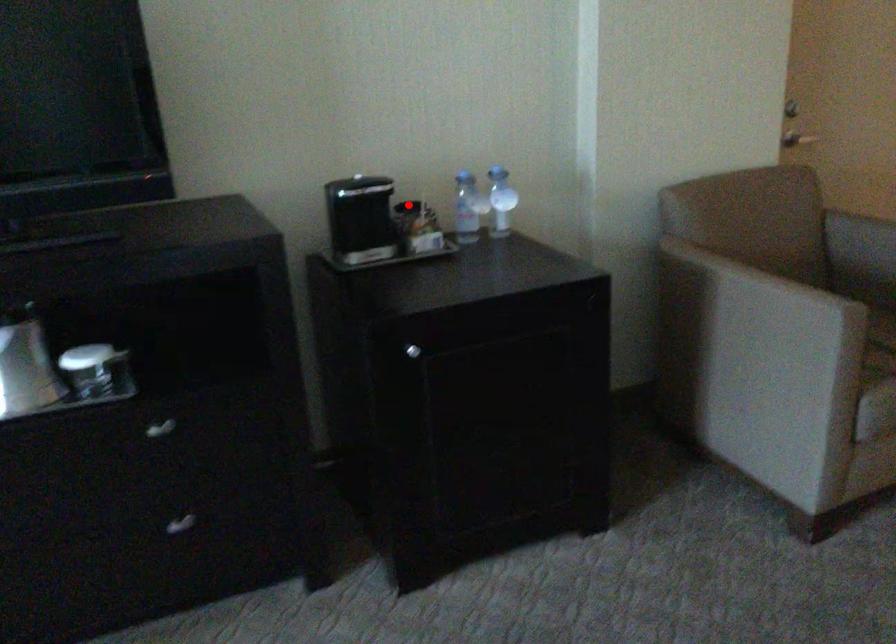
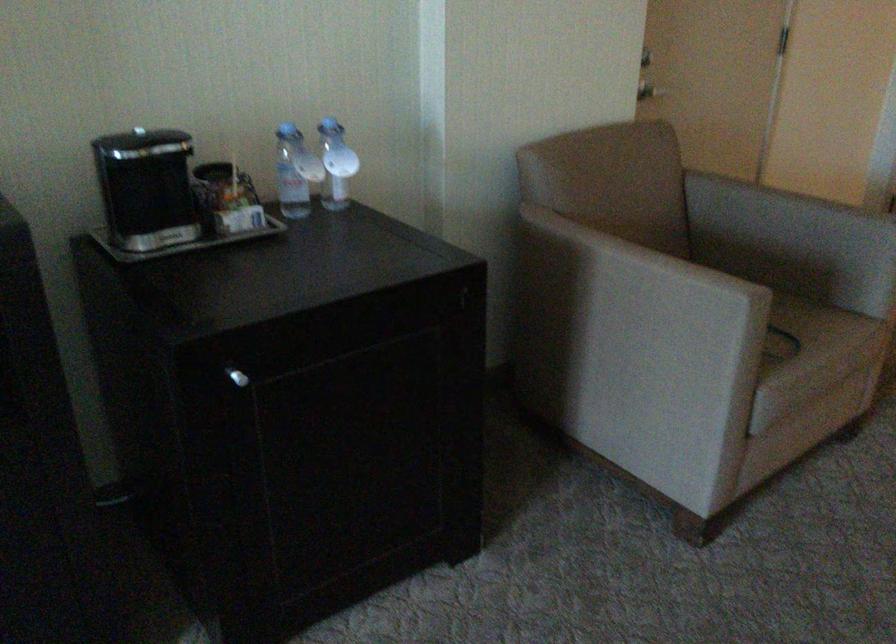
Question: I am providing you with two images of the same scene from different viewpoints. A red point is shown in image1. For the corresponding object point in image2, is it positioned nearer or farther from the camera?

Choices:
 (A) Nearer
 (B) Farther

Answer: (A)